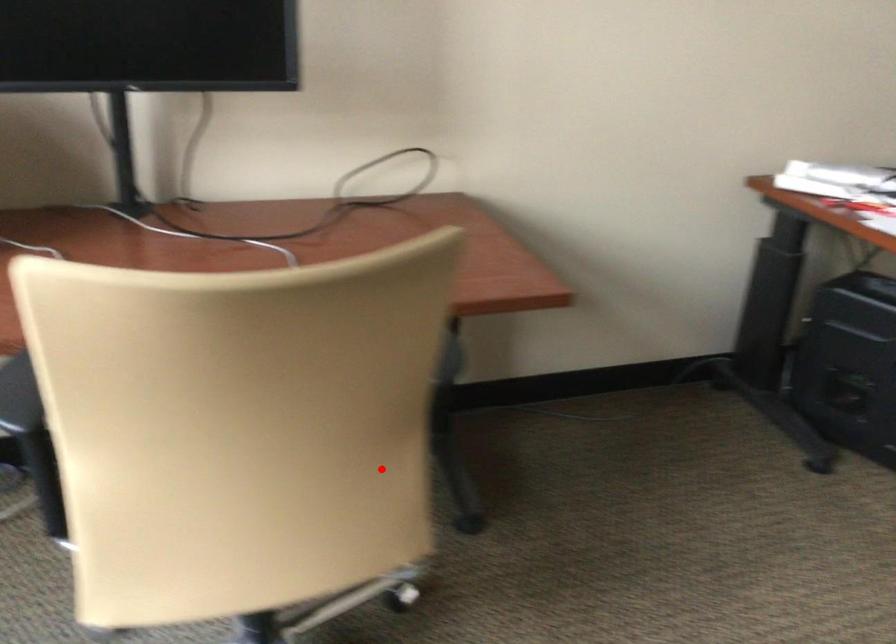
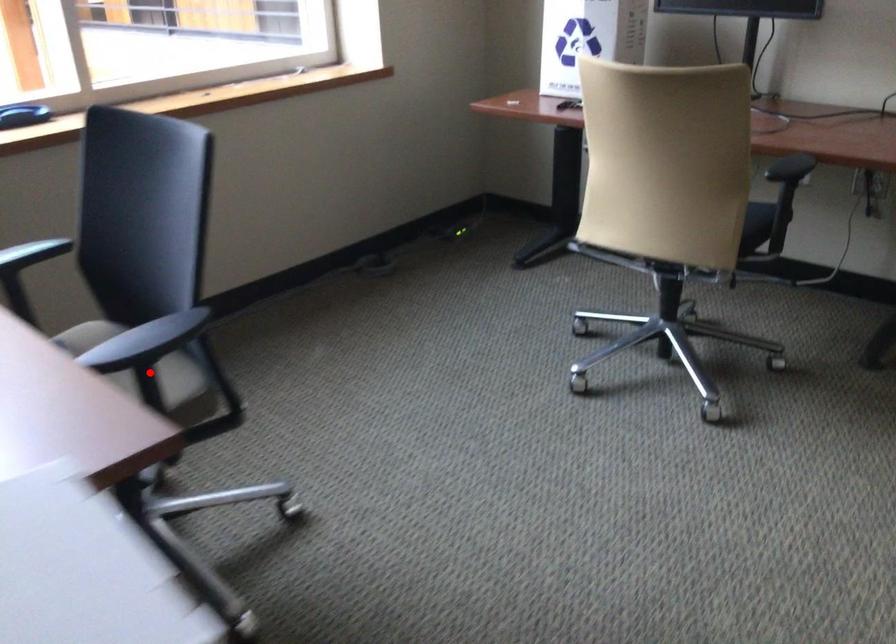
I am providing you with two images of the same scene from different viewpoints. A red point is marked on the first image and another point is marked on the second image. Does the point marked in image1 correspond to the same location as the one in image2?

No